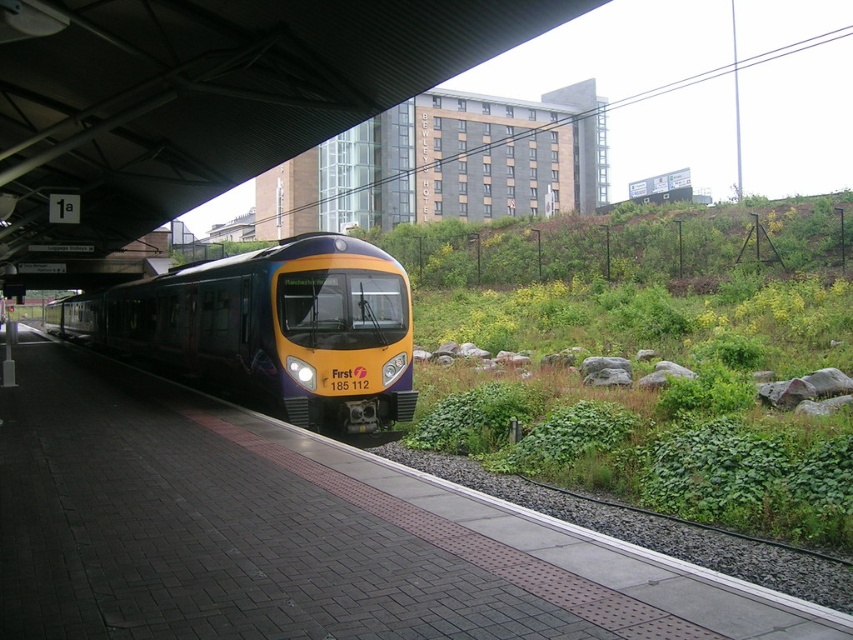
What do you see at coordinates (302, 534) in the screenshot? I see `brick platform at center` at bounding box center [302, 534].

Is point (19, 413) positioned before point (262, 349)?

Yes, point (19, 413) is in front of point (262, 349).

Which is in front, point (399, 467) or point (244, 358)?

Point (399, 467) is in front.

Where is `brick platform at center`? brick platform at center is located at coordinates (302, 534).